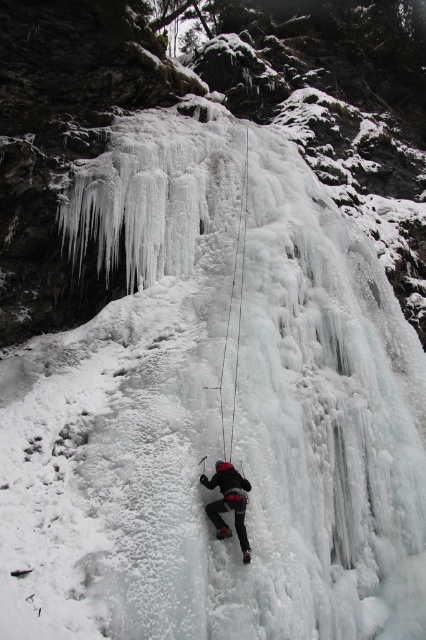
Who is more forward, [226,445] or [245,493]?

Point [245,493] is in front.

Does clear ice rope at center appear over black matte climbing gear at center?

Yes.

Is point (241, 234) closer to camera compared to point (238, 515)?

No, (241, 234) is further to viewer.

The image size is (426, 640). I want to click on clear ice rope at center, so click(x=235, y=321).